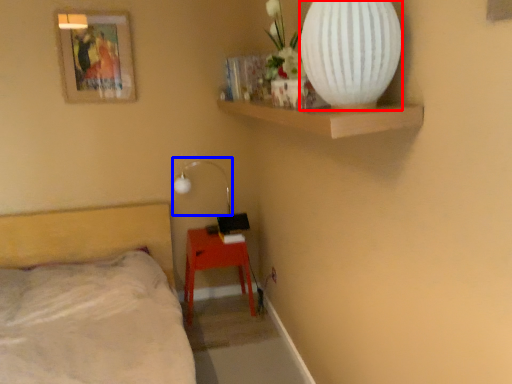
Question: Which of the following is the closest to the observer, vase (highlighted by a red box) or lamp (highlighted by a blue box)?

Choices:
 (A) vase
 (B) lamp

Answer: (A)